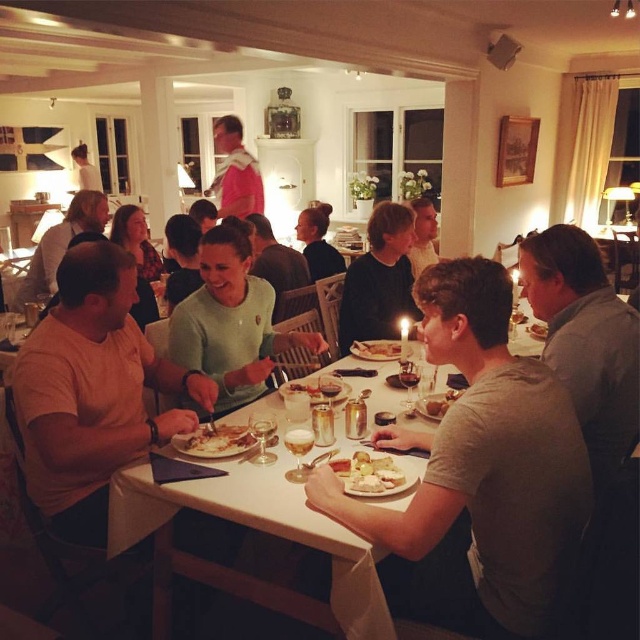
You are a photographer trying to capture a group photo of the people seated around the dining table. You want to ensure that both the gray cotton shirt at lower right and the green matte sweater at center are clearly visible in the photo. Which person should you position closer to the camera to ensure their clothing detail is captured properly?

The gray cotton shirt at lower right has a larger width than the green matte sweater at center. To ensure both are clearly visible, position the person wearing the green matte sweater at center closer to the camera since their clothing detail is smaller and might be less visible from a distance.

You are standing at the center of the dining table and want to pass a napkin to the person wearing the gray cotton shirt at lower right. In which direction should you move to reach their location?

The gray cotton shirt at lower right is located at point (484, 458). Since you are at the center of the table, you should move towards the lower right direction to reach their location.

You are a server at a restaurant and need to place a new dish on the table. The dish is as wide as the smooth white plate at center. Is there enough space next to the gray cotton shirt at lower right to place it without overlapping?

The gray cotton shirt at lower right is wider than the smooth white plate at center. Since the dish is as wide as the smooth white plate at center, there should be enough space next to the gray cotton shirt at lower right to place it without overlapping.